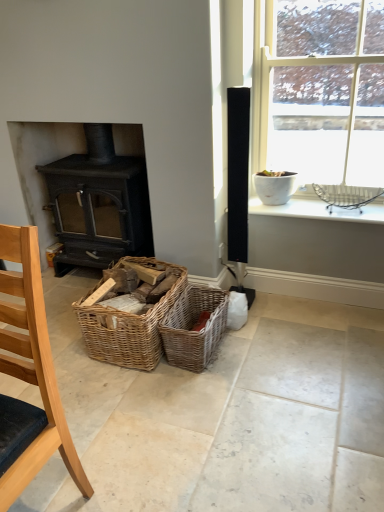
Locate an element on the screen. This screenshot has height=512, width=384. woven wood baskets at center, marked as the 2th picnic basket in a right-to-left arrangement is located at coordinates click(x=128, y=325).

What is the approximate height of white ceramic bowl at upper right?

It is 1.62 inches.

Identify the location of matte black wood burning stove at left. The image size is (384, 512). (98, 204).

This screenshot has width=384, height=512. What do you see at coordinates (192, 327) in the screenshot? I see `woven brown picnic basket at center, the first picnic basket from the right` at bounding box center [192, 327].

Identify the location of light wood chair at lower left. Image resolution: width=384 pixels, height=512 pixels. (31, 368).

Is white glossy pot at upper right next to light wood chair at lower left and touching it?

No, white glossy pot at upper right is not beside light wood chair at lower left.

Considering the sizes of objects white glossy pot at upper right and light wood chair at lower left in the image provided, who is shorter, white glossy pot at upper right or light wood chair at lower left?

light wood chair at lower left is shorter.

Considering the relative positions of white glossy pot at upper right and light wood chair at lower left in the image provided, is white glossy pot at upper right to the left of light wood chair at lower left from the viewer's perspective?

No, white glossy pot at upper right is not to the left of light wood chair at lower left.

Considering the relative sizes of white glossy pot at upper right and light wood chair at lower left in the image provided, is white glossy pot at upper right smaller than light wood chair at lower left?

No, white glossy pot at upper right is not smaller than light wood chair at lower left.

Considering the relative sizes of matte black wood burning stove at left and light wood chair at lower left in the image provided, is matte black wood burning stove at left wider than light wood chair at lower left?

Indeed, matte black wood burning stove at left has a greater width compared to light wood chair at lower left.

Considering the positions of objects matte black wood burning stove at left and light wood chair at lower left in the image provided, who is more to the left, matte black wood burning stove at left or light wood chair at lower left?

matte black wood burning stove at left is more to the left.

From the picture: From a real-world perspective, is matte black wood burning stove at left positioned above or below light wood chair at lower left?

In terms of real-world spatial position, matte black wood burning stove at left is above light wood chair at lower left.

Considering the relative positions of matte black wood burning stove at left and light wood chair at lower left in the image provided, is matte black wood burning stove at left in front of light wood chair at lower left?

No.

Considering the sizes of objects woven brown picnic basket at center, the first picnic basket from the right, and metallic wire basket at upper right in the image provided, who is shorter, woven brown picnic basket at center, the first picnic basket from the right, or metallic wire basket at upper right?

Standing shorter between the two is metallic wire basket at upper right.

Is woven brown picnic basket at center, positioned as the second picnic basket in left-to-right order, positioned with its back to metallic wire basket at upper right?

woven brown picnic basket at center, positioned as the second picnic basket in left-to-right order, is not turned away from metallic wire basket at upper right.

Is woven brown picnic basket at center, the first picnic basket from the right, inside the boundaries of metallic wire basket at upper right, or outside?

woven brown picnic basket at center, the first picnic basket from the right, cannot be found inside metallic wire basket at upper right.

Is white glossy pot at upper right not near white ceramic bowl at upper right?

white glossy pot at upper right is actually quite close to white ceramic bowl at upper right.

Is white glossy pot at upper right wider than white ceramic bowl at upper right?

Incorrect, the width of white glossy pot at upper right does not surpass that of white ceramic bowl at upper right.

How much distance is there between white glossy pot at upper right and white ceramic bowl at upper right?

A distance of 21.50 inches exists between white glossy pot at upper right and white ceramic bowl at upper right.

Is white glossy pot at upper right situated inside white ceramic bowl at upper right or outside?

white glossy pot at upper right is not inside white ceramic bowl at upper right, it's outside.

Does woven brown picnic basket at center, the first picnic basket from the right, touch white ceramic bowl at upper right?

No, woven brown picnic basket at center, the first picnic basket from the right, is not beside white ceramic bowl at upper right.

Does woven brown picnic basket at center, the first picnic basket from the right, lie in front of white ceramic bowl at upper right?

Yes.

Is woven brown picnic basket at center, the first picnic basket from the right, located outside white ceramic bowl at upper right?

woven brown picnic basket at center, the first picnic basket from the right, is positioned outside white ceramic bowl at upper right.

Considering the sizes of objects woven brown picnic basket at center, positioned as the second picnic basket in left-to-right order, and white ceramic bowl at upper right in the image provided, who is taller, woven brown picnic basket at center, positioned as the second picnic basket in left-to-right order, or white ceramic bowl at upper right?

Standing taller between the two is woven brown picnic basket at center, positioned as the second picnic basket in left-to-right order.

From a real-world perspective, is woven wood baskets at center, which ranks as the 1th picnic basket in left-to-right order, located beneath light wood chair at lower left?

Yes, from a real-world perspective, woven wood baskets at center, which ranks as the 1th picnic basket in left-to-right order, is beneath light wood chair at lower left.

Between woven wood baskets at center, which ranks as the 1th picnic basket in left-to-right order, and light wood chair at lower left, which one is positioned behind?

woven wood baskets at center, which ranks as the 1th picnic basket in left-to-right order, is more distant.

From the image's perspective, is woven wood baskets at center, which ranks as the 1th picnic basket in left-to-right order, under light wood chair at lower left?

Incorrect, from the image's perspective, woven wood baskets at center, which ranks as the 1th picnic basket in left-to-right order, is higher than light wood chair at lower left.

Is light wood chair at lower left at the back of woven wood baskets at center, marked as the 2th picnic basket in a right-to-left arrangement?

That's not correct — woven wood baskets at center, marked as the 2th picnic basket in a right-to-left arrangement, is not looking away from light wood chair at lower left.

How much distance is there between metallic wire basket at upper right and white glossy pot at upper right?

A distance of 17.91 inches exists between metallic wire basket at upper right and white glossy pot at upper right.

Is metallic wire basket at upper right oriented towards white glossy pot at upper right?

No.

Is metallic wire basket at upper right to the left of white glossy pot at upper right from the viewer's perspective?

No.

In the scene shown: From the image's perspective, is metallic wire basket at upper right beneath white glossy pot at upper right?

Indeed, from the image's perspective, metallic wire basket at upper right is shown beneath white glossy pot at upper right.

Locate an element on the screen. window located on the right of light wood chair at lower left is located at coordinates (x=321, y=93).

This screenshot has width=384, height=512. Identify the location of chair in front of the matte black wood burning stove at left. click(x=31, y=368).

From the image, which object appears to be farther from white glossy pot at upper right, light wood chair at lower left or metallic wire basket at upper right?

The object further to white glossy pot at upper right is light wood chair at lower left.

Estimate the real-world distances between objects in this image. Which object is further from light wood chair at lower left, metallic wire basket at upper right or woven wood baskets at center, which ranks as the 1th picnic basket in left-to-right order?

The object further to light wood chair at lower left is metallic wire basket at upper right.

Considering their positions, is white glossy pot at upper right positioned closer to woven wood baskets at center, marked as the 2th picnic basket in a right-to-left arrangement, than metallic wire basket at upper right?

The object closer to woven wood baskets at center, marked as the 2th picnic basket in a right-to-left arrangement, is metallic wire basket at upper right.

Looking at the image, which one is located closer to white ceramic bowl at upper right, light wood chair at lower left or white glossy pot at upper right?

The object closer to white ceramic bowl at upper right is white glossy pot at upper right.

In the scene shown: Looking at the image, which one is located closer to matte black wood burning stove at left, white ceramic bowl at upper right or light wood chair at lower left?

white ceramic bowl at upper right is positioned closer to the anchor matte black wood burning stove at left.

Estimate the real-world distances between objects in this image. Which object is further from light wood chair at lower left, white ceramic bowl at upper right or white glossy pot at upper right?

Based on the image, white glossy pot at upper right appears to be further to light wood chair at lower left.

Estimate the real-world distances between objects in this image. Which object is closer to woven wood baskets at center, which ranks as the 1th picnic basket in left-to-right order, white glossy pot at upper right or light wood chair at lower left?

Based on the image, light wood chair at lower left appears to be nearer to woven wood baskets at center, which ranks as the 1th picnic basket in left-to-right order.

Estimate the real-world distances between objects in this image. Which object is further from white glossy pot at upper right, white ceramic bowl at upper right or light wood chair at lower left?

Based on the image, light wood chair at lower left appears to be further to white glossy pot at upper right.

The image size is (384, 512). In order to click on basket between white glossy pot at upper right and woven brown picnic basket at center, positioned as the second picnic basket in left-to-right order, from top to bottom in this screenshot , I will do point(346,196).

The image size is (384, 512). I want to click on window situated between matte black wood burning stove at left and white ceramic bowl at upper right from left to right, so click(x=321, y=93).

In order to click on chair between matte black wood burning stove at left and white glossy pot at upper right in the horizontal direction in this screenshot , I will do `click(31, 368)`.

At what (x,y) coordinates should I click in order to perform the action: click on window sill positioned between light wood chair at lower left and matte black wood burning stove at left from near to far. Please return your answer as a coordinate pair (x, y). Looking at the image, I should click on (317, 211).